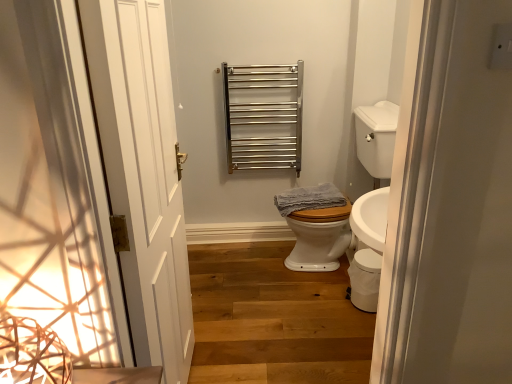
What is the approximate width of blue textured towel at center?

Answer: 16.65 inches.

The width and height of the screenshot is (512, 384). What do you see at coordinates (309, 198) in the screenshot? I see `blue textured towel at center` at bounding box center [309, 198].

In order to face polished stainless steel towel rack at upper center, should I rotate leftwards or rightwards?

You should rotate right by 1.242 degrees.

I want to click on white glossy sink at right, so click(376, 138).

I want to click on blue textured towel at center, so pyautogui.click(x=309, y=198).

Considering the relative sizes of blue textured towel at center and wooden stairs at center in the image provided, is blue textured towel at center thinner than wooden stairs at center?

Yes, blue textured towel at center is thinner than wooden stairs at center.

Considering the relative positions of blue textured towel at center and wooden stairs at center in the image provided, is blue textured towel at center to the left or to the right of wooden stairs at center?

blue textured towel at center is positioned on wooden stairs at center's right side.

Is the surface of blue textured towel at center in direct contact with wooden stairs at center?

No, blue textured towel at center is not with wooden stairs at center.

Considering the relative sizes of blue textured towel at center and white wooden door at left in the image provided, is blue textured towel at center bigger than white wooden door at left?

Actually, blue textured towel at center might be smaller than white wooden door at left.

Does blue textured towel at center turn towards white wooden door at left?

No, blue textured towel at center is not oriented towards white wooden door at left.

Which of these two, blue textured towel at center or white wooden door at left, stands taller?

Standing taller between the two is white wooden door at left.

Is white glossy sink at right directly adjacent to white glossy toilet bowl at lower right?

No, white glossy sink at right is not beside white glossy toilet bowl at lower right.

From a real-world perspective, is white glossy sink at right on white glossy toilet bowl at lower right?

Yes, from a real-world perspective, white glossy sink at right is on top of white glossy toilet bowl at lower right.

In the scene shown: Could you tell me if white glossy sink at right is facing white glossy toilet bowl at lower right?

No, white glossy sink at right is not oriented towards white glossy toilet bowl at lower right.

Looking at the image, does white glossy sink at right seem bigger or smaller compared to white glossy toilet bowl at lower right?

In the image, white glossy sink at right appears to be larger than white glossy toilet bowl at lower right.

This screenshot has height=384, width=512. I want to click on balustrade behind the white wooden door at left, so (264, 116).

Is white wooden door at left bigger than polished stainless steel towel rack at upper center?

Actually, white wooden door at left might be smaller than polished stainless steel towel rack at upper center.

In the scene shown: Is white wooden door at left thinner than polished stainless steel towel rack at upper center?

Indeed, white wooden door at left has a lesser width compared to polished stainless steel towel rack at upper center.

Between white wooden door at left and polished stainless steel towel rack at upper center, which one has less height?

Standing shorter between the two is polished stainless steel towel rack at upper center.

From the image's perspective, which object appears higher, blue textured towel at center or polished stainless steel towel rack at upper center?

From the image's view, polished stainless steel towel rack at upper center is above.

Does blue textured towel at center come behind polished stainless steel towel rack at upper center?

No, it is in front of polished stainless steel towel rack at upper center.

Which is correct: blue textured towel at center is inside polished stainless steel towel rack at upper center, or outside of it?

blue textured towel at center is not inside polished stainless steel towel rack at upper center, it's outside.

Which object is wider, blue textured towel at center or polished stainless steel towel rack at upper center?

blue textured towel at center is wider.

Find the location of a particular element. This screenshot has width=512, height=384. door on the left of white glossy sink at right is located at coordinates (143, 173).

Who is more distant, white glossy sink at right or white wooden door at left?

white glossy sink at right.

From a real-world perspective, is white glossy sink at right beneath white wooden door at left?

Yes.

From a real-world perspective, which is physically below, white glossy toilet bowl at lower right or white glossy sink at right?

In real-world perspective, white glossy toilet bowl at lower right is lower.

From the picture: Is white glossy toilet bowl at lower right not within white glossy sink at right?

Absolutely, white glossy toilet bowl at lower right is external to white glossy sink at right.

Who is shorter, white glossy toilet bowl at lower right or white glossy sink at right?

Standing shorter between the two is white glossy toilet bowl at lower right.

From the image's perspective, is white glossy toilet bowl at lower right on white glossy sink at right?

No, from the image's perspective, white glossy toilet bowl at lower right is not above white glossy sink at right.

In the image, there is a wooden stairs at center. At what (x,y) coordinates should I click in order to perform the action: click on material above it (from the image's perspective). Please return your answer as a coordinate pair (x, y). Image resolution: width=512 pixels, height=384 pixels. Looking at the image, I should click on (309, 198).

Image resolution: width=512 pixels, height=384 pixels. Find the location of `door below the blue textured towel at center (from the image's perspective)`. door below the blue textured towel at center (from the image's perspective) is located at coordinates (143, 173).

Estimate the real-world distances between objects in this image. Which object is closer to white wooden door at left, white glossy sink at right or white glossy toilet bowl at lower right?

Based on the image, white glossy toilet bowl at lower right appears to be nearer to white wooden door at left.

Looking at the image, which one is located further to polished stainless steel towel rack at upper center, white wooden door at left or white glossy sink at right?

white wooden door at left is further to polished stainless steel towel rack at upper center.

Which object lies further to the anchor point wooden stairs at center, blue textured towel at center or white glossy toilet bowl at lower right?

blue textured towel at center lies further to wooden stairs at center than the other object.

Looking at the image, which one is located further to white wooden door at left, white glossy toilet bowl at lower right or blue textured towel at center?

blue textured towel at center lies further to white wooden door at left than the other object.

Estimate the real-world distances between objects in this image. Which object is closer to white wooden door at left, polished stainless steel towel rack at upper center or wooden stairs at center?

wooden stairs at center is positioned closer to the anchor white wooden door at left.

From the image, which object appears to be nearer to white glossy sink at right, polished stainless steel towel rack at upper center or blue textured towel at center?

blue textured towel at center is closer to white glossy sink at right.

Which object lies nearer to the anchor point wooden stairs at center, polished stainless steel towel rack at upper center or white glossy toilet bowl at lower right?

white glossy toilet bowl at lower right is positioned closer to the anchor wooden stairs at center.

Estimate the real-world distances between objects in this image. Which object is closer to white wooden door at left, polished stainless steel towel rack at upper center or blue textured towel at center?

Based on the image, blue textured towel at center appears to be nearer to white wooden door at left.

This screenshot has height=384, width=512. I want to click on toilet bowl located between white wooden door at left and blue textured towel at center in the depth direction, so click(365, 279).

Identify the location of material between white wooden door at left and polished stainless steel towel rack at upper center from front to back. Image resolution: width=512 pixels, height=384 pixels. (309, 198).

At what (x,y) coordinates should I click in order to perform the action: click on sink between white wooden door at left and white glossy toilet bowl at lower right in the front-back direction. Please return your answer as a coordinate pair (x, y). Looking at the image, I should click on (376, 138).

This screenshot has width=512, height=384. I want to click on stairs between white wooden door at left and white glossy sink at right from front to back, so click(x=273, y=319).